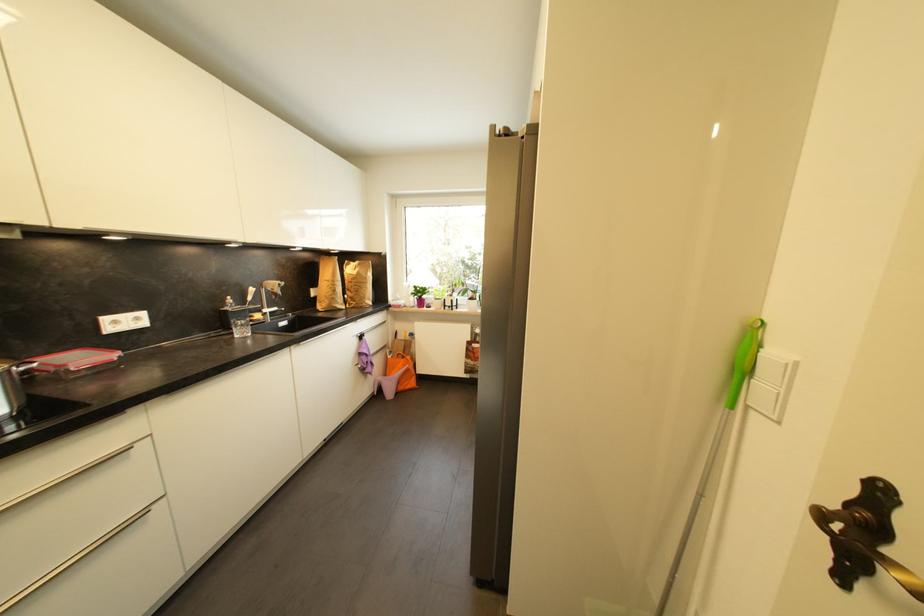
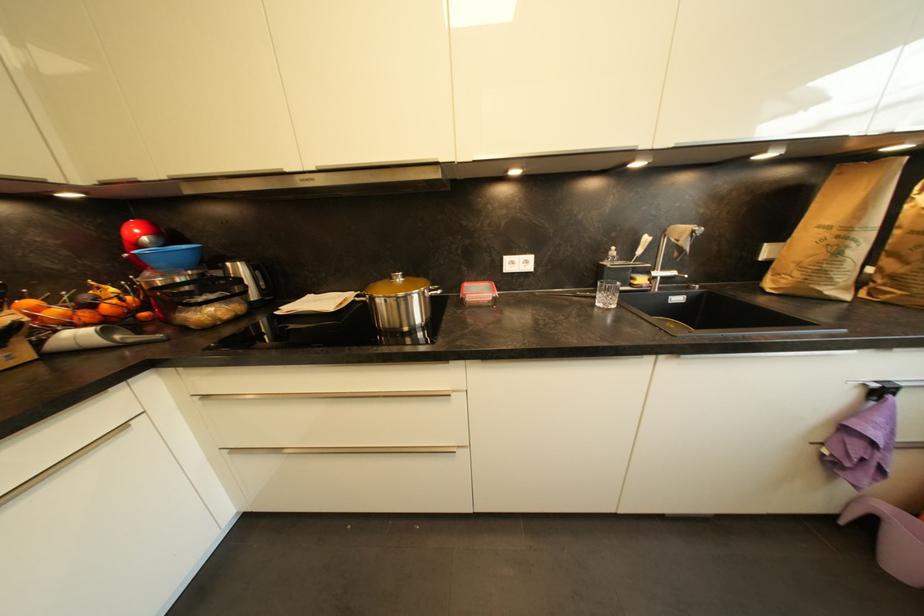
Looking at this image, the first image is from the beginning of the video and the second image is from the end. How did the camera likely rotate when shooting the video?

The camera rotated toward left-down.